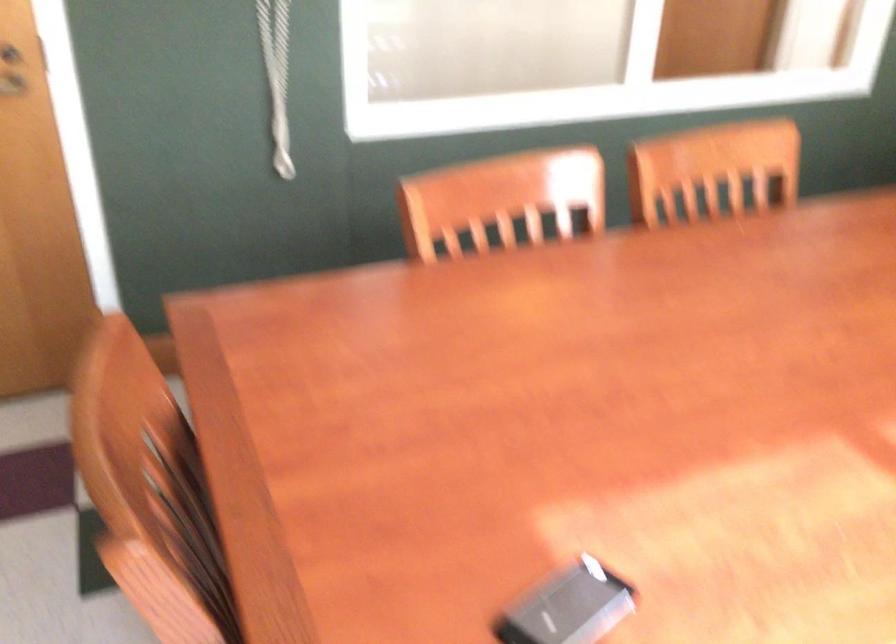
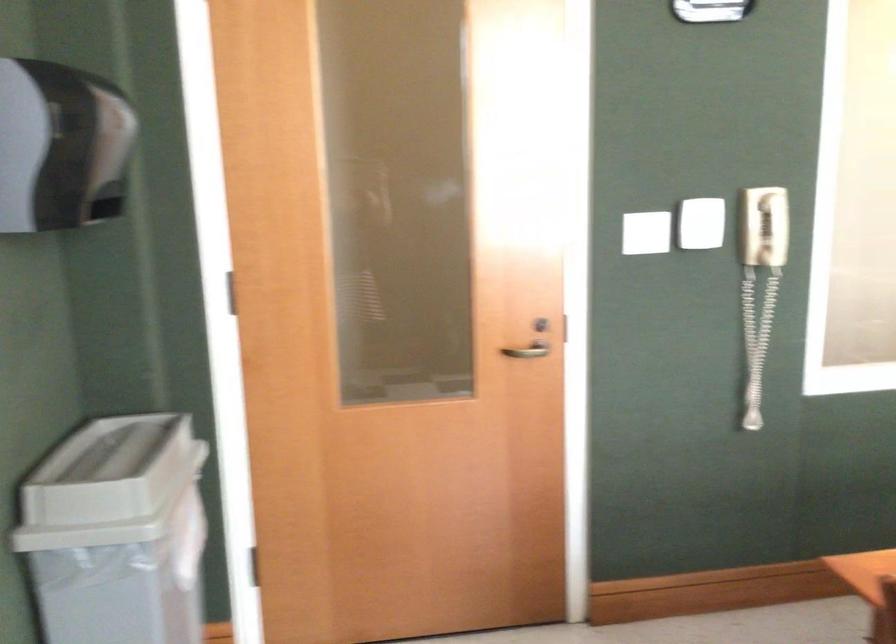
Based on the continuous images, in which direction is the camera rotating?

The rotation direction of the camera is left-up.